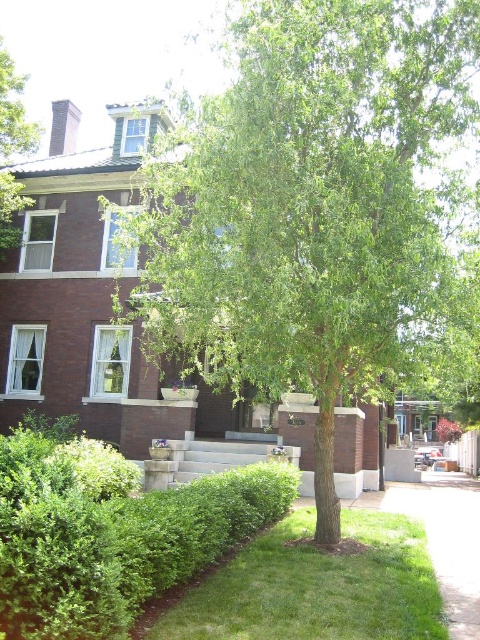
You are standing at the point marked as point (309, 204) in the image. What object are you currently standing on?

You are standing on the green leafy tree at center.

What are the coordinates of the green leafy tree at center?

The coordinates of the green leafy tree at center are at point (309, 204).